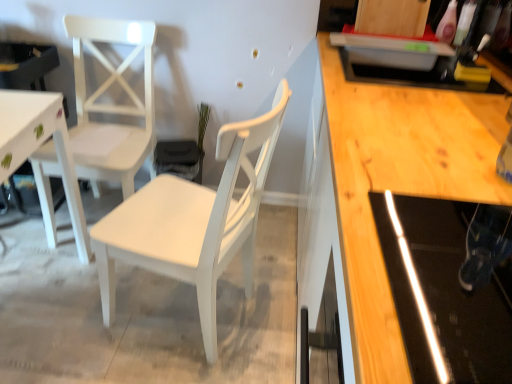
Question: Is white painted wood chair at center, marked as the second chair in a left-to-right arrangement, wider or thinner than white matte chair at left, positioned as the 2th chair in right-to-left order?

Choices:
 (A) thin
 (B) wide

Answer: (B)

Question: In the image, is white painted wood chair at center, marked as the second chair in a left-to-right arrangement, positioned in front of or behind white matte chair at left, positioned as the 2th chair in right-to-left order?

Choices:
 (A) behind
 (B) front

Answer: (B)

Question: Considering the relative positions of white painted wood chair at center, positioned as the 1th chair in right-to-left order, and white matte chair at left, the 1th chair in the left-to-right sequence, in the image provided, is white painted wood chair at center, positioned as the 1th chair in right-to-left order, to the left or to the right of white matte chair at left, the 1th chair in the left-to-right sequence,?

Choices:
 (A) right
 (B) left

Answer: (A)

Question: In the image, is white matte chair at left, positioned as the 2th chair in right-to-left order, on the left side or the right side of white painted wood chair at center, marked as the second chair in a left-to-right arrangement?

Choices:
 (A) left
 (B) right

Answer: (A)

Question: Looking at the image, does white matte chair at left, the 1th chair in the left-to-right sequence, seem bigger or smaller compared to white painted wood chair at center, positioned as the 1th chair in right-to-left order?

Choices:
 (A) big
 (B) small

Answer: (B)

Question: From a real-world perspective, is white matte chair at left, positioned as the 2th chair in right-to-left order, above or below white painted wood chair at center, positioned as the 1th chair in right-to-left order?

Choices:
 (A) below
 (B) above

Answer: (A)

Question: Considering the positions of white matte chair at left, the 1th chair in the left-to-right sequence, and white painted wood chair at center, marked as the second chair in a left-to-right arrangement, in the image, is white matte chair at left, the 1th chair in the left-to-right sequence, wider or thinner than white painted wood chair at center, marked as the second chair in a left-to-right arrangement,?

Choices:
 (A) thin
 (B) wide

Answer: (A)